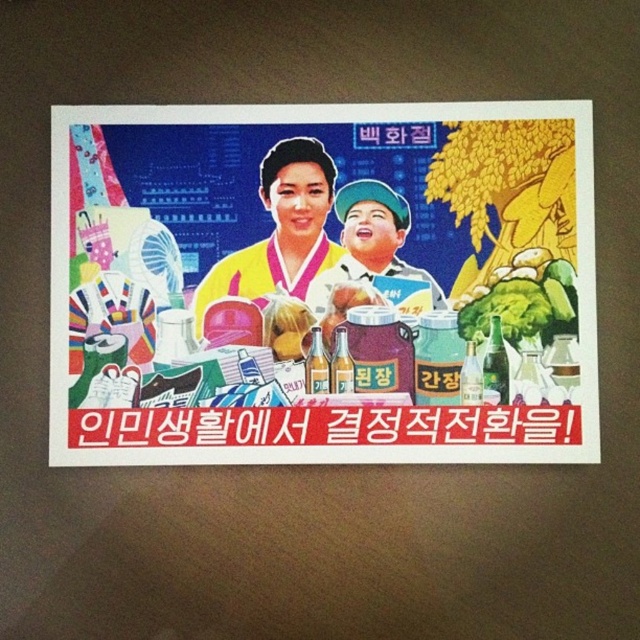
Does point (436, 173) come closer to viewer compared to point (400, 202)?

That is True.

Who is taller, matte plastic bottle at center or matte plastic cup at center?

matte plastic bottle at center is taller.

Between point (301, 209) and point (374, 240), which one is positioned in front?

Point (301, 209) is more forward.

You are a GUI agent. You are given a task and a screenshot of the screen. Output one action in this format:
    pyautogui.click(x=<x>, y=<y>)
    Task: Click on the matte plastic bottle at center
    The width and height of the screenshot is (640, 640).
    Given the screenshot: What is the action you would take?
    pyautogui.click(x=323, y=284)

Who is more forward, (x=524, y=460) or (x=296, y=193)?

Point (x=524, y=460)

Does point (408, 237) come behind point (280, 186)?

Yes, point (408, 237) is farther from viewer.

You are a GUI agent. You are given a task and a screenshot of the screen. Output one action in this format:
    pyautogui.click(x=<x>, y=<y>)
    Task: Click on the matte plastic bottle at center
    The image size is (640, 640).
    Given the screenshot: What is the action you would take?
    pyautogui.click(x=323, y=284)

What do you see at coordinates (280, 228) in the screenshot? This screenshot has height=640, width=640. I see `yellow silk kimono at center` at bounding box center [280, 228].

Who is taller, yellow silk kimono at center or matte plastic cup at center?

With more height is yellow silk kimono at center.

Where is `yellow silk kimono at center`? yellow silk kimono at center is located at coordinates (280, 228).